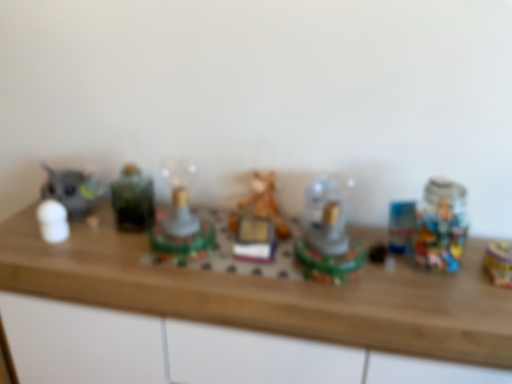
Locate an element on the screen. vacant area that is situated to the right of translucent plastic toy at center, marked as the 2th toy in a right-to-left arrangement is located at coordinates (407, 285).